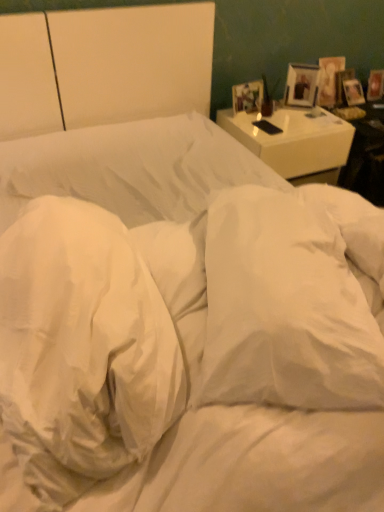
Question: Is white glossy nightstand at upper right shorter than matte wooden picture frame at upper right, which is the first picture frame from front to back?

Choices:
 (A) no
 (B) yes

Answer: (A)

Question: Is white glossy nightstand at upper right looking in the opposite direction of matte wooden picture frame at upper right, which is the first picture frame from front to back?

Choices:
 (A) no
 (B) yes

Answer: (A)

Question: Considering the relative sizes of white glossy nightstand at upper right and matte wooden picture frame at upper right, which ranks as the 1th picture frame in left-to-right order, in the image provided, is white glossy nightstand at upper right taller than matte wooden picture frame at upper right, which ranks as the 1th picture frame in left-to-right order,?

Choices:
 (A) yes
 (B) no

Answer: (A)

Question: Is the position of white glossy nightstand at upper right more distant than that of matte wooden picture frame at upper right, which is counted as the third picture frame, starting from the back?

Choices:
 (A) yes
 (B) no

Answer: (B)

Question: Is white glossy nightstand at upper right to the left of matte wooden picture frame at upper right, which is counted as the third picture frame, starting from the back, from the viewer's perspective?

Choices:
 (A) yes
 (B) no

Answer: (B)

Question: Relative to matte wooden picture frame at upper right, which ranks as the 1th picture frame in left-to-right order, is white soft pillow at center, acting as the 1th pillow starting from the left, in front or behind?

Choices:
 (A) behind
 (B) front

Answer: (B)

Question: Is white soft pillow at center, acting as the 1th pillow starting from the left, inside the boundaries of matte wooden picture frame at upper right, placed as the third picture frame when sorted from right to left, or outside?

Choices:
 (A) outside
 (B) inside

Answer: (A)

Question: Considering the positions of white soft pillow at center, the second pillow when ordered from right to left, and matte wooden picture frame at upper right, which ranks as the 1th picture frame in left-to-right order, in the image, is white soft pillow at center, the second pillow when ordered from right to left, taller or shorter than matte wooden picture frame at upper right, which ranks as the 1th picture frame in left-to-right order,?

Choices:
 (A) short
 (B) tall

Answer: (B)

Question: Based on their sizes in the image, would you say white soft pillow at center, the second pillow when ordered from right to left, is bigger or smaller than matte wooden picture frame at upper right, which is counted as the third picture frame, starting from the back?

Choices:
 (A) small
 (B) big

Answer: (B)

Question: Is matte wooden picture frame at upper right, placed as the third picture frame when sorted from right to left, wider or thinner than wooden picture frame at upper right, the 2th picture frame positioned from the back?

Choices:
 (A) wide
 (B) thin

Answer: (B)

Question: From the image's perspective, relative to wooden picture frame at upper right, the second picture frame when ordered from front to back, is matte wooden picture frame at upper right, placed as the third picture frame when sorted from right to left, above or below?

Choices:
 (A) above
 (B) below

Answer: (B)

Question: Considering the positions of matte wooden picture frame at upper right, which is counted as the third picture frame, starting from the back, and wooden picture frame at upper right, the second picture frame when ordered from front to back, in the image, is matte wooden picture frame at upper right, which is counted as the third picture frame, starting from the back, taller or shorter than wooden picture frame at upper right, the second picture frame when ordered from front to back,?

Choices:
 (A) short
 (B) tall

Answer: (A)

Question: Is matte wooden picture frame at upper right, which ranks as the 1th picture frame in left-to-right order, in front of or behind wooden picture frame at upper right, which is the 2th picture frame in left-to-right order, in the image?

Choices:
 (A) behind
 (B) front

Answer: (B)

Question: In terms of width, does wooden picture frame at upper right, which is the 2th picture frame in left-to-right order, look wider or thinner when compared to white soft pillow at center, acting as the 1th pillow starting from the left?

Choices:
 (A) thin
 (B) wide

Answer: (A)

Question: From a real-world perspective, is wooden picture frame at upper right, the 2th picture frame positioned from the back, positioned above or below white soft pillow at center, the second pillow when ordered from right to left?

Choices:
 (A) above
 (B) below

Answer: (B)